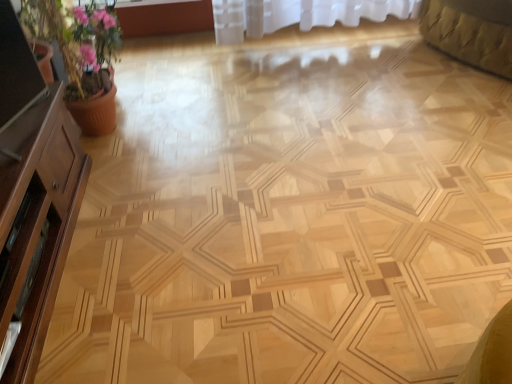
Question: From a real-world perspective, is pink clay pot at left located higher than brown wood dresser at left?

Choices:
 (A) no
 (B) yes

Answer: (B)

Question: Can you confirm if pink clay pot at left is smaller than brown wood dresser at left?

Choices:
 (A) no
 (B) yes

Answer: (A)

Question: Does pink clay pot at left appear on the right side of brown wood dresser at left?

Choices:
 (A) no
 (B) yes

Answer: (B)

Question: Does pink clay pot at left appear on the left side of brown wood dresser at left?

Choices:
 (A) no
 (B) yes

Answer: (A)

Question: Is the surface of pink clay pot at left in direct contact with brown wood dresser at left?

Choices:
 (A) no
 (B) yes

Answer: (A)

Question: Considering the positions of pink clay pot at left and matte wooden screen door at left in the image, is pink clay pot at left bigger or smaller than matte wooden screen door at left?

Choices:
 (A) big
 (B) small

Answer: (A)

Question: From the image's perspective, is pink clay pot at left located above or below matte wooden screen door at left?

Choices:
 (A) above
 (B) below

Answer: (A)

Question: In the image, is pink clay pot at left on the left side or the right side of matte wooden screen door at left?

Choices:
 (A) right
 (B) left

Answer: (B)

Question: Is pink clay pot at left taller or shorter than matte wooden screen door at left?

Choices:
 (A) short
 (B) tall

Answer: (B)

Question: From the image's perspective, is matte wooden screen door at left located above or below pink clay pot at left?

Choices:
 (A) below
 (B) above

Answer: (A)

Question: Would you say matte wooden screen door at left is to the left or to the right of pink clay pot at left in the picture?

Choices:
 (A) left
 (B) right

Answer: (B)

Question: From a real-world perspective, is matte wooden screen door at left positioned above or below pink clay pot at left?

Choices:
 (A) above
 (B) below

Answer: (B)

Question: In the image, is matte wooden screen door at left positioned in front of or behind pink clay pot at left?

Choices:
 (A) behind
 (B) front

Answer: (B)

Question: From a real-world perspective, is brown wood dresser at left above or below pink clay pot at left?

Choices:
 (A) below
 (B) above

Answer: (A)

Question: In the image, is brown wood dresser at left on the left side or the right side of pink clay pot at left?

Choices:
 (A) left
 (B) right

Answer: (A)